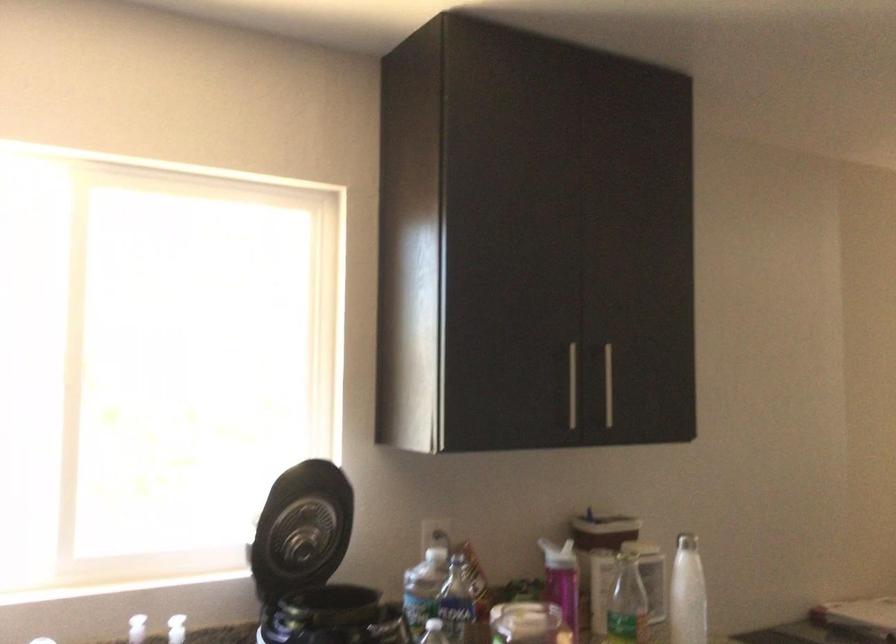
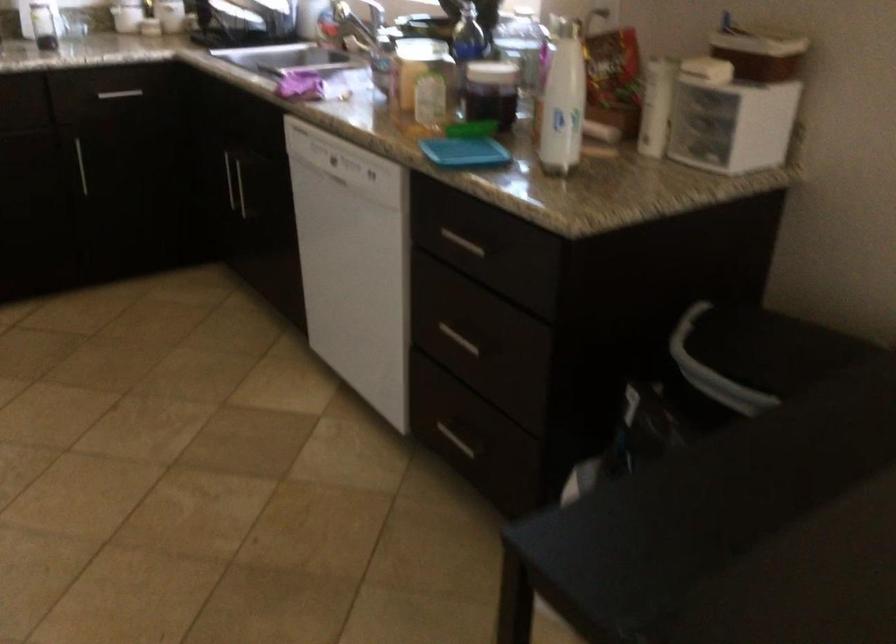
Find the pixel in the second image that matches point (643, 559) in the first image.

(563, 100)